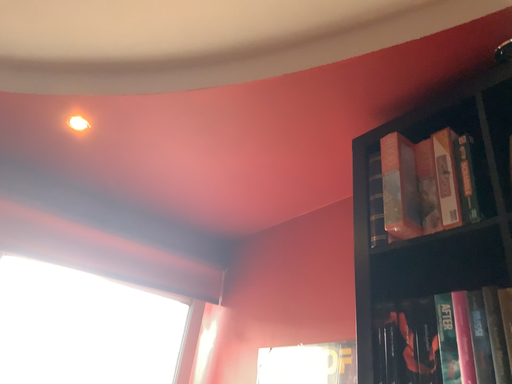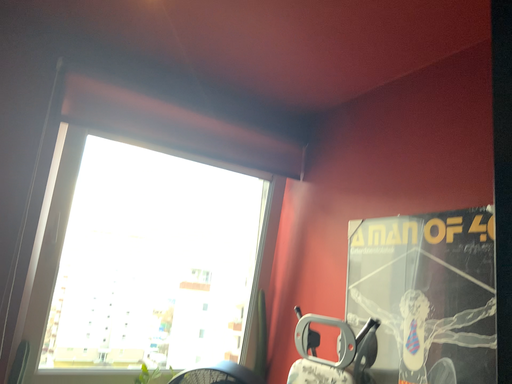
Question: Which way did the camera rotate in the video?

Choices:
 (A) rotated right
 (B) rotated left

Answer: (B)